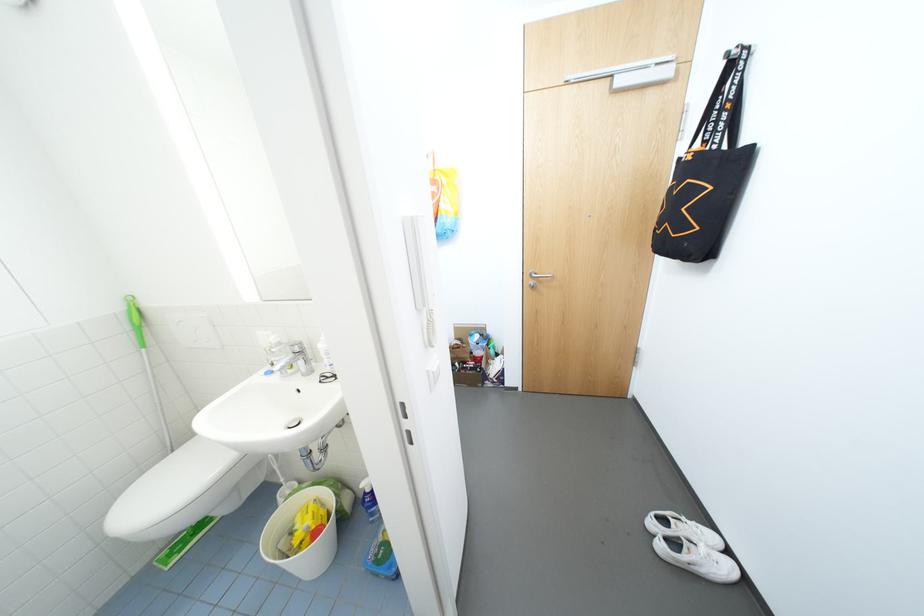
Identify the location of black bag strap. (737, 55).